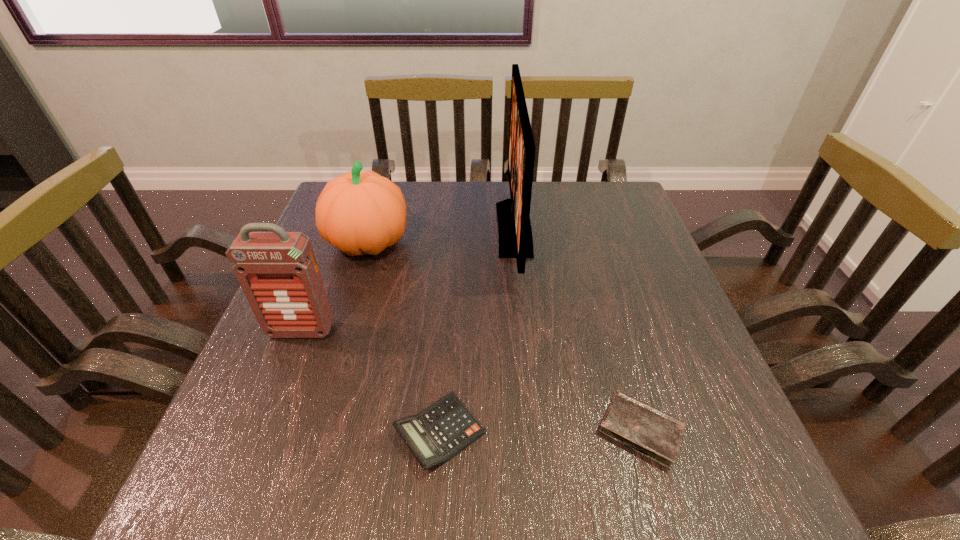
I want to click on the first-aid kit that is positioned at the left edge, so click(278, 272).

The width and height of the screenshot is (960, 540). Identify the location of pumpkin that is at the left edge. (359, 213).

At what (x,y) coordinates should I click in order to perform the action: click on object present at the right edge. Please return your answer as a coordinate pair (x, y). Looking at the image, I should click on (651, 432).

Locate an element on the screen. This screenshot has height=540, width=960. object positioned at the far left corner is located at coordinates (359, 213).

You are a GUI agent. You are given a task and a screenshot of the screen. Output one action in this format:
    pyautogui.click(x=<x>, y=<y>)
    Task: Click on the object that is at the near right corner
    The height and width of the screenshot is (540, 960).
    Given the screenshot: What is the action you would take?
    pyautogui.click(x=651, y=432)

Image resolution: width=960 pixels, height=540 pixels. I want to click on vacant point at the far edge, so click(411, 201).

The image size is (960, 540). In the image, there is a desktop. What are the coordinates of `vacant space at the near edge` in the screenshot? It's located at (557, 472).

Identify the location of vacant space at the left edge of the desktop. (351, 281).

Identify the location of blank space at the right edge. (682, 362).

You are a GUI agent. You are given a task and a screenshot of the screen. Output one action in this format:
    pyautogui.click(x=<x>, y=<y>)
    Task: Click on the vacant point located between the third farthest object and the third object from left to right
    This screenshot has height=540, width=960.
    Given the screenshot: What is the action you would take?
    pyautogui.click(x=371, y=382)